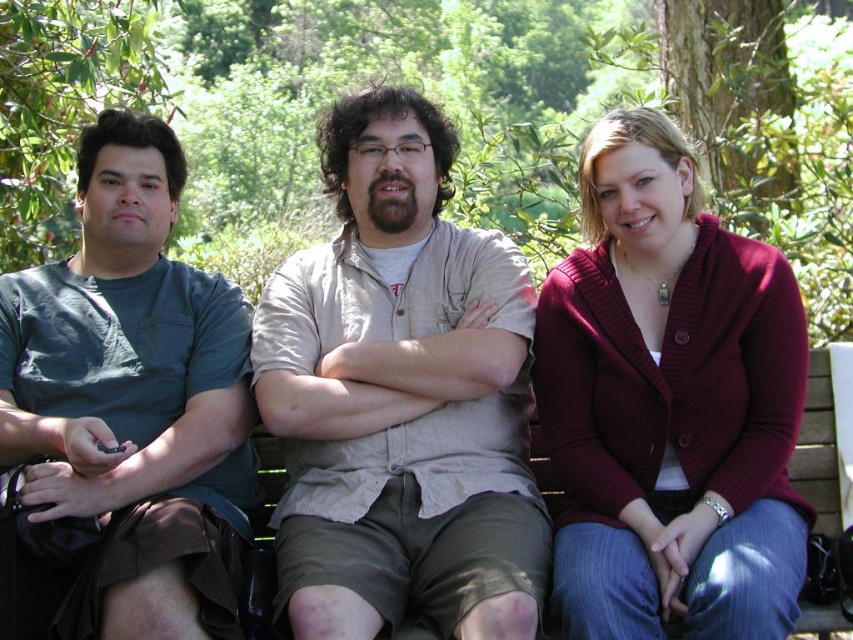
Is point (418, 586) more distant than point (711, 381)?

No, it is not.

Locate an element on the screen. The height and width of the screenshot is (640, 853). beige cotton shirt at center is located at coordinates (399, 396).

Image resolution: width=853 pixels, height=640 pixels. In order to click on beige cotton shirt at center in this screenshot , I will do [399, 396].

Is beige cotton shirt at center smaller than matte green t-shirt at left?

No.

Is beige cotton shirt at center below matte green t-shirt at left?

No, beige cotton shirt at center is not below matte green t-shirt at left.

Does point (525, 269) lie in front of point (213, 627)?

That is False.

The height and width of the screenshot is (640, 853). Identify the location of beige cotton shirt at center. (399, 396).

How much distance is there between maroon knit cardigan at center and matte green t-shirt at left?

They are 9.29 feet apart.

Is maroon knit cardigan at center closer to camera compared to matte green t-shirt at left?

That is False.

Is point (606, 134) positioned behind point (112, 340)?

No.

Where is `maroon knit cardigan at center`? This screenshot has height=640, width=853. maroon knit cardigan at center is located at coordinates (669, 404).